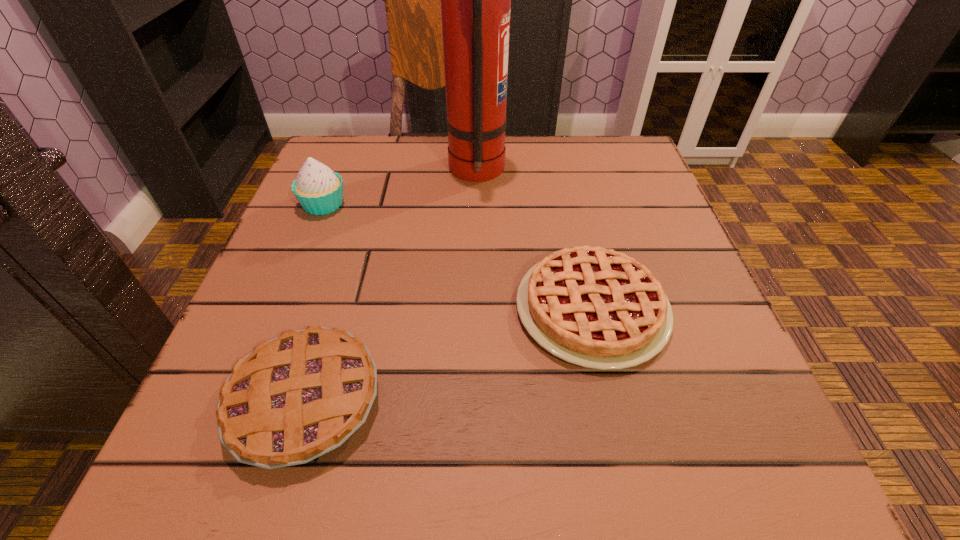
This screenshot has width=960, height=540. In order to click on cupcake positioned at the far edge in this screenshot , I will do `click(319, 190)`.

The image size is (960, 540). What are the coordinates of `object located at the near edge` in the screenshot? It's located at (296, 397).

Image resolution: width=960 pixels, height=540 pixels. I want to click on cupcake at the left edge, so click(319, 190).

Locate an element on the screen. The width and height of the screenshot is (960, 540). pie that is at the left edge is located at coordinates (296, 397).

I want to click on object present at the right edge, so pyautogui.click(x=594, y=307).

Identify the location of object that is at the far left corner. The height and width of the screenshot is (540, 960). (319, 190).

Identify the location of object positioned at the near left corner. The height and width of the screenshot is (540, 960). (296, 397).

Where is `free space at the far edge`? The height and width of the screenshot is (540, 960). free space at the far edge is located at coordinates coord(562,156).

You are a GUI agent. You are given a task and a screenshot of the screen. Output one action in this format:
    pyautogui.click(x=<x>, y=<y>)
    Task: Click on the vacant space at the near edge of the desktop
    
    Given the screenshot: What is the action you would take?
    pyautogui.click(x=488, y=430)

Where is `free space at the left edge of the desktop`? The width and height of the screenshot is (960, 540). free space at the left edge of the desktop is located at coordinates (299, 285).